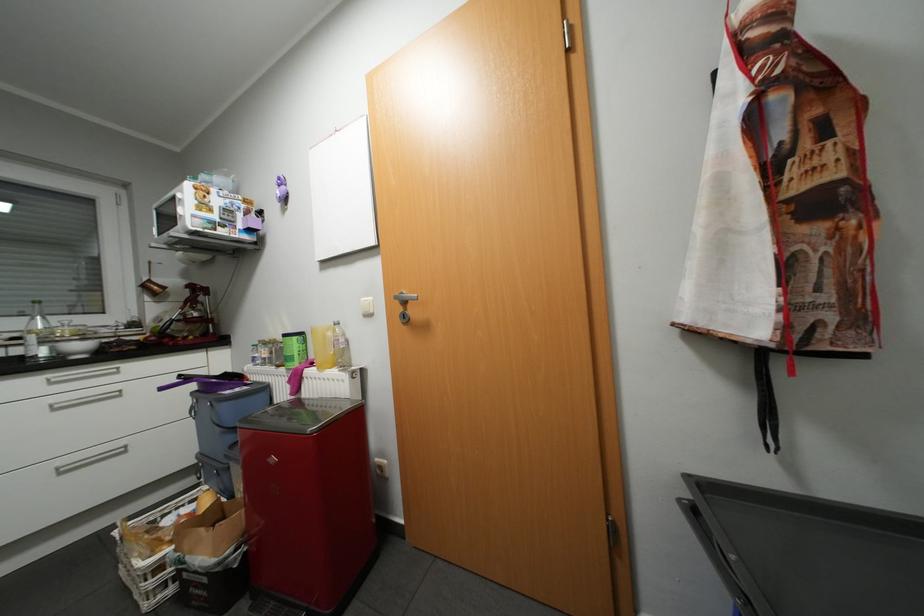
The location [151,551] corresponds to which object?

This point indicates the white wire basket.